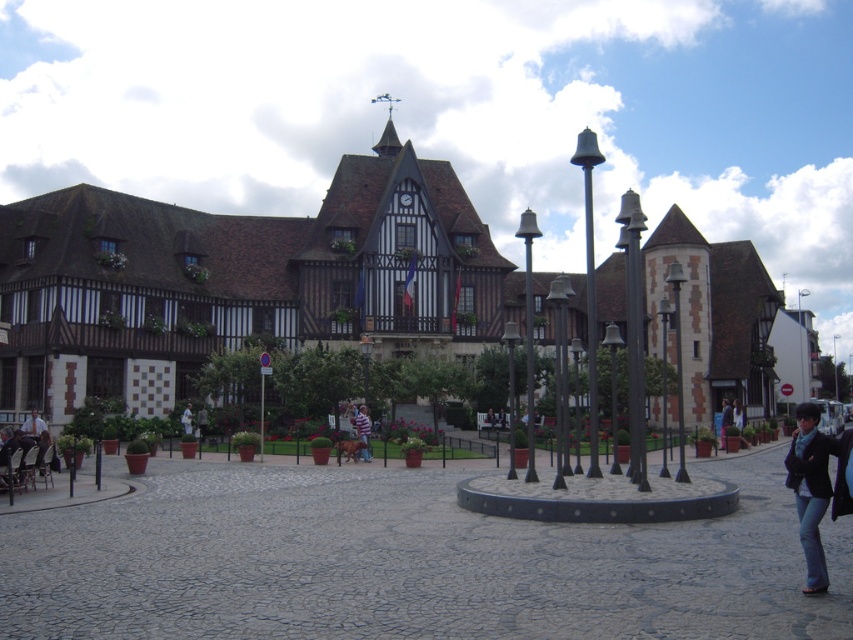
Question: Is wooden timber building at center closer to the viewer compared to denim jeans at lower right?

Choices:
 (A) no
 (B) yes

Answer: (A)

Question: Considering the real-world distances, which object is farthest from the striped shirt at center?

Choices:
 (A) wooden timber building at center
 (B) denim jeans at lower right
 (C) white cotton shirt at center

Answer: (B)

Question: Which object is farther from the camera taking this photo?

Choices:
 (A) denim jeans at lower right
 (B) wooden timber building at center
 (C) striped shirt at center

Answer: (C)

Question: Is wooden timber building at center closer to the viewer compared to white cotton shirt at center?

Choices:
 (A) no
 (B) yes

Answer: (B)

Question: Does denim jeans at lower right appear on the right side of white cotton shirt at center?

Choices:
 (A) yes
 (B) no

Answer: (A)

Question: Which object is farther from the camera taking this photo?

Choices:
 (A) striped shirt at center
 (B) black leather jacket at lower right
 (C) denim jeans at lower right

Answer: (B)